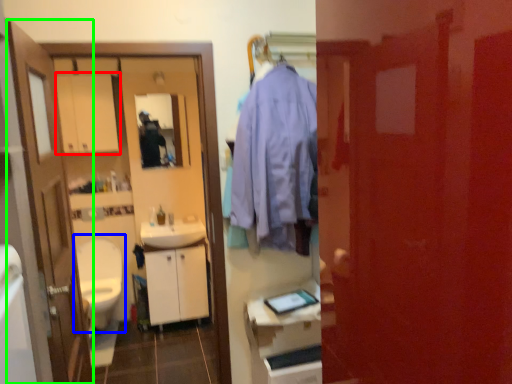
Question: Which object is positioned closest to medicine cabinet (highlighted by a red box)? Select from toilet (highlighted by a blue box) and door (highlighted by a green box).

Choices:
 (A) toilet
 (B) door

Answer: (A)